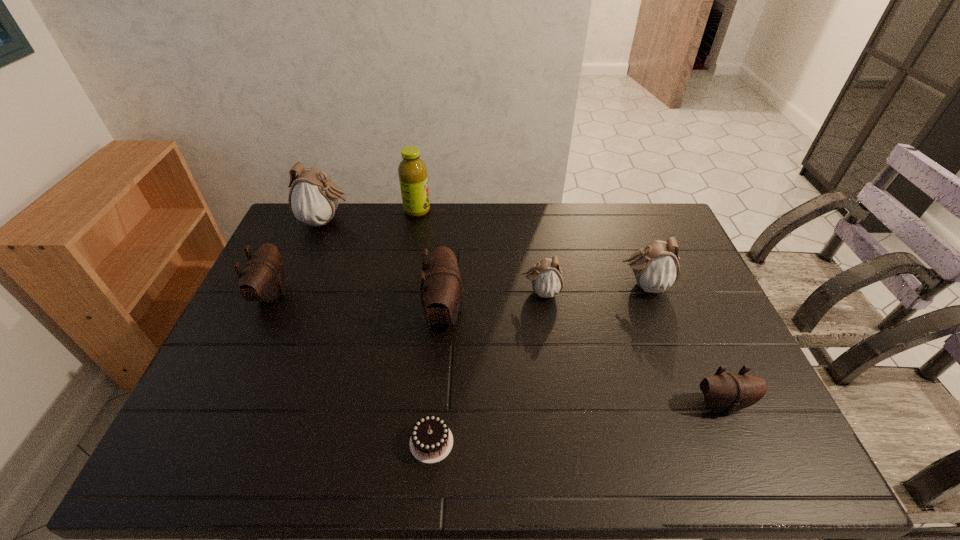
Where is `empty location between the nearest pouch and the fruit juice`? empty location between the nearest pouch and the fruit juice is located at coordinates (569, 307).

The width and height of the screenshot is (960, 540). What are the coordinates of `vacant area that lies between the leftmost brown pouch and the nearest object` in the screenshot? It's located at (351, 368).

Where is `free area in between the farthest white pouch and the second brown pouch from right to left`? The height and width of the screenshot is (540, 960). free area in between the farthest white pouch and the second brown pouch from right to left is located at coordinates (385, 267).

Identify the location of free point between the rightmost white pouch and the second brown pouch from right to left. (544, 299).

Where is `free point between the fruit juice and the shortest object`? This screenshot has height=540, width=960. free point between the fruit juice and the shortest object is located at coordinates (424, 326).

Locate which object ranks in proximity to the nearest brown pouch. Please provide its 2D coordinates. Your answer should be formatted as a tuple, i.e. [(x, y)], where the tuple contains the x and y coordinates of a point satisfying the conditions above.

[(656, 268)]

I want to click on object that can be found as the sixth closest to the fruit juice, so click(x=431, y=441).

Find the location of a particular element. This screenshot has height=540, width=960. pouch that is the second closest one to the second brown pouch from right to left is located at coordinates (313, 199).

Choose which pouch is the fifth nearest neighbor to the smallest brown pouch. Please provide its 2D coordinates. Your answer should be formatted as a tuple, i.e. [(x, y)], where the tuple contains the x and y coordinates of a point satisfying the conditions above.

[(313, 199)]

Identify which white pouch is the second closest to the rightmost white pouch. Please provide its 2D coordinates. Your answer should be formatted as a tuple, i.e. [(x, y)], where the tuple contains the x and y coordinates of a point satisfying the conditions above.

[(313, 199)]